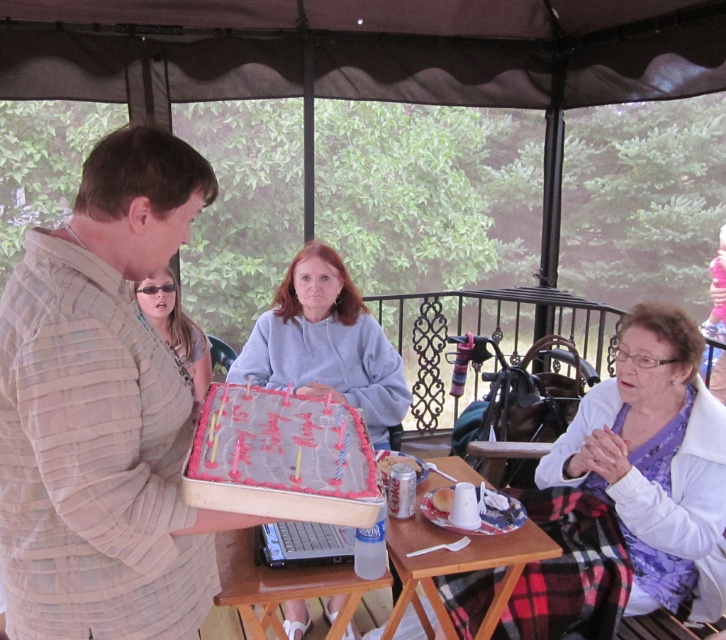
You are a caterer setting up for an event and need to place a 1.5 meter long tablecloth over the table where the pink frosted cake at center and sunglasses at center are located. Based on the distance between the two items, will the tablecloth be long enough to cover both ends of the table?

The distance between the pink frosted cake at center and sunglasses at center is 1.26 meters. Since the tablecloth is 1.5 meters long, it will be long enough to cover both ends of the table as it exceeds the distance between the two items by 0.24 meters.

You are at the birthday gathering and need to place a gift on the table. The gift is too large to fit between the light beige textured shirt at center and the white fabric at lower right. Which side of the table should you place it on?

Since the light beige textured shirt at center is to the left of the white fabric at lower right, you should place the gift on the right side of the table beyond the white fabric at lower right to ensure there is enough space.

You are attending a birthday party and notice two items at the center of the scene. Which item is larger in size between the light beige textured shirt at center and the pink frosted cake at center?

The light beige textured shirt at center is bigger than the pink frosted cake at center according to the description.